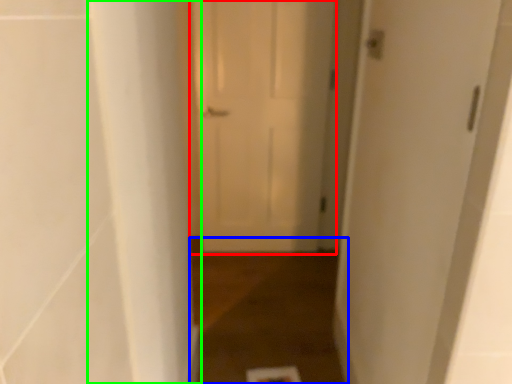
Question: Considering the real-world distances, which object is farthest from door (highlighted by a red box)? path (highlighted by a blue box) or pillar (highlighted by a green box)?

Choices:
 (A) path
 (B) pillar

Answer: (B)